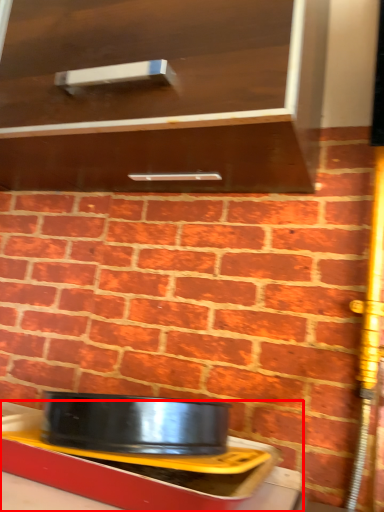
Question: Considering the relative positions of table (annotated by the red box) and cabinetry in the image provided, where is table (annotated by the red box) located with respect to the staircase?

Choices:
 (A) right
 (B) left

Answer: (A)